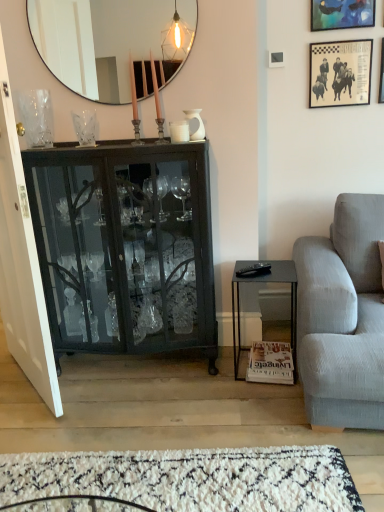
You are a GUI agent. You are given a task and a screenshot of the screen. Output one action in this format:
    pyautogui.click(x=<x>, y=<y>)
    Task: Click on the vacant area situated below black glass cabinet at left (from a real-world perspective)
    This screenshot has height=512, width=384.
    Given the screenshot: What is the action you would take?
    pyautogui.click(x=113, y=366)